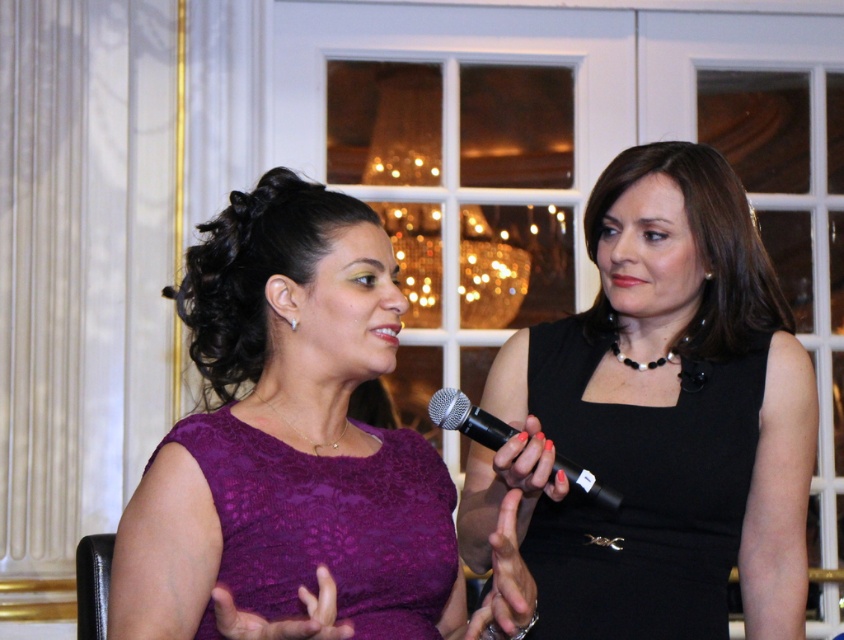
Question: Can you confirm if purple lace dress at center is positioned to the left of black satin dress at center?

Choices:
 (A) yes
 (B) no

Answer: (A)

Question: Estimate the real-world distances between objects in this image. Which object is closer to the lace purple dress at center?

Choices:
 (A) black matte microphone at center
 (B) purple lace dress at center

Answer: (B)

Question: Does purple lace dress at center appear on the right side of black satin dress at center?

Choices:
 (A) no
 (B) yes

Answer: (A)

Question: Is black satin dress at center further to the viewer compared to black matte microphone at center?

Choices:
 (A) yes
 (B) no

Answer: (A)

Question: Which of the following is the closest to the observer?

Choices:
 (A) black matte microphone at center
 (B) lace purple dress at center
 (C) black satin dress at center
 (D) purple lace dress at center

Answer: (D)

Question: Which point is farther from the camera taking this photo?

Choices:
 (A) (745, 371)
 (B) (257, 512)

Answer: (A)